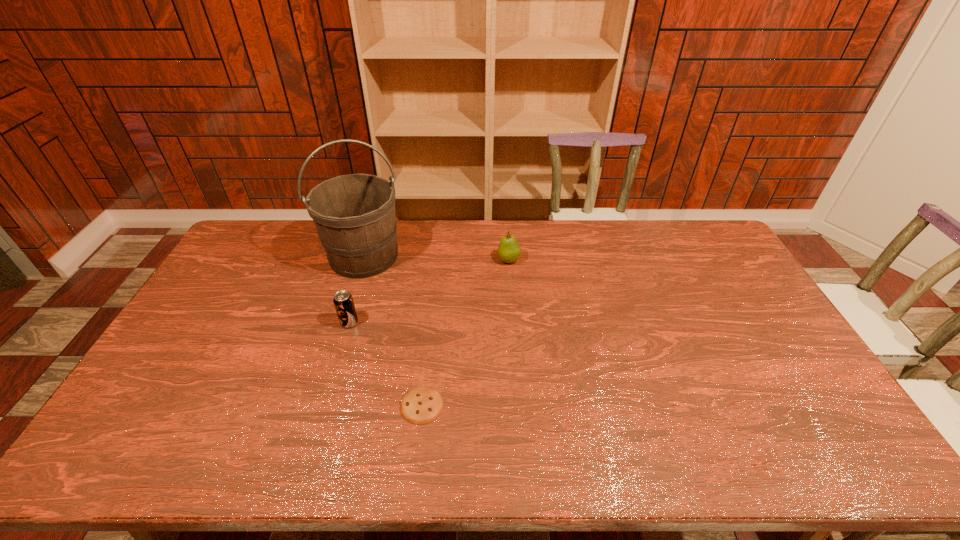
Image resolution: width=960 pixels, height=540 pixels. In order to click on pear that is at the far edge in this screenshot , I will do `click(509, 251)`.

The width and height of the screenshot is (960, 540). Identify the location of vacant space at the far edge. (489, 246).

At what (x,y) coordinates should I click in order to perform the action: click on free space at the near edge of the desktop. Please return your answer as a coordinate pair (x, y). The width and height of the screenshot is (960, 540). Looking at the image, I should click on (263, 457).

The width and height of the screenshot is (960, 540). In order to click on blank space at the left edge of the desktop in this screenshot , I will do `click(208, 374)`.

Image resolution: width=960 pixels, height=540 pixels. In order to click on vacant region at the right edge of the desktop in this screenshot , I will do `click(709, 296)`.

Where is `free location at the far left corner of the desktop`? The image size is (960, 540). free location at the far left corner of the desktop is located at coordinates (266, 251).

In the image, there is a desktop. Where is `vacant space at the near left corner`? Image resolution: width=960 pixels, height=540 pixels. vacant space at the near left corner is located at coordinates (124, 446).

Image resolution: width=960 pixels, height=540 pixels. Identify the location of vacant space in between the tallest object and the soda can. (357, 289).

The image size is (960, 540). In order to click on free spot between the second nearest object and the bucket in this screenshot , I will do `click(357, 289)`.

I want to click on empty location between the second nearest object and the nearest object, so click(386, 364).